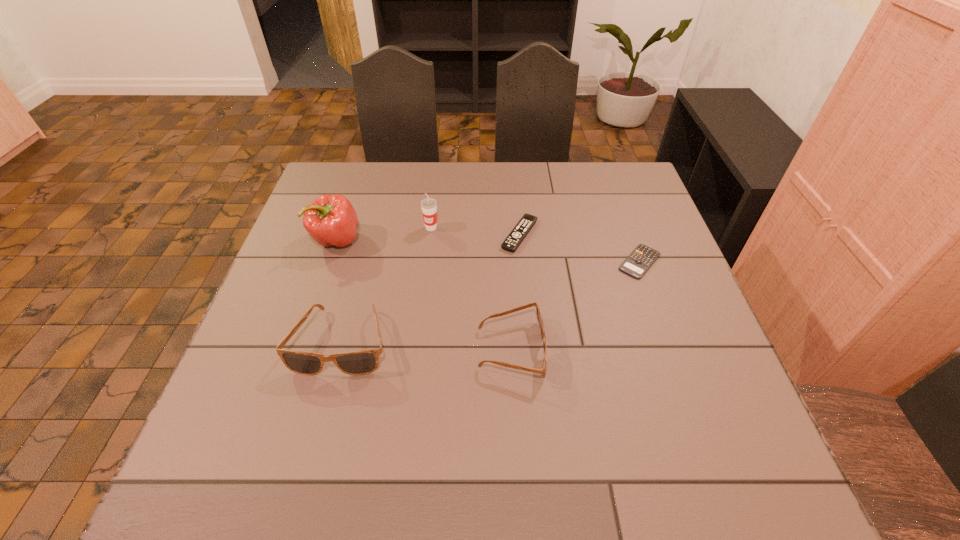
Where is `vacant region located on the back of the calculator`? The height and width of the screenshot is (540, 960). vacant region located on the back of the calculator is located at coordinates (613, 188).

At what (x,y) coordinates should I click in order to perform the action: click on vacant region located on the side of the cup with the logo. Please return your answer as a coordinate pair (x, y). Image resolution: width=960 pixels, height=540 pixels. Looking at the image, I should click on (420, 315).

At what (x,y) coordinates should I click in order to perform the action: click on vacant region located on the left of the second shortest object. Please return your answer as a coordinate pair (x, y). The image size is (960, 540). Looking at the image, I should click on (383, 234).

Where is `vacant space located on the right of the pepper`? This screenshot has height=540, width=960. vacant space located on the right of the pepper is located at coordinates tap(417, 240).

Identify the location of sunglasses at the left edge. This screenshot has width=960, height=540. (362, 362).

Identify the location of pepper that is at the left edge. (331, 220).

What are the coordinates of `object that is at the right edge` in the screenshot? It's located at (640, 260).

Find the location of a particular element. This screenshot has height=540, width=960. free space at the far edge of the desktop is located at coordinates (436, 179).

I want to click on free space at the near edge of the desktop, so click(x=563, y=412).

Locate an element on the screen. This screenshot has width=960, height=540. free space at the left edge is located at coordinates (319, 255).